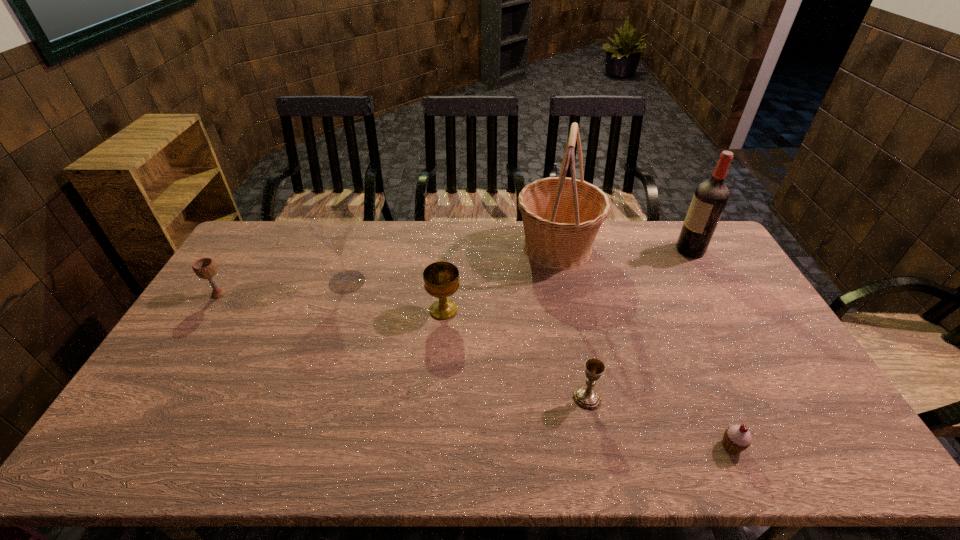
Where is `empty space between the sixth object from right to left and the second object from right to left`? This screenshot has width=960, height=540. empty space between the sixth object from right to left and the second object from right to left is located at coordinates (540, 364).

Identify which object is the second nearest to the rightmost object. Please provide its 2D coordinates. Your answer should be formatted as a tuple, i.e. [(x, y)], where the tuple contains the x and y coordinates of a point satisfying the conditions above.

[(586, 396)]

Find the location of a particular element. The image size is (960, 540). object identified as the closest to the leftmost chalice is located at coordinates (333, 229).

Where is `chalice that is the closest to the second tallest object`? This screenshot has height=540, width=960. chalice that is the closest to the second tallest object is located at coordinates (586, 396).

Locate an element on the screen. chalice that is the nearest to the rightmost chalice is located at coordinates (441, 279).

Where is `vacant area in the image that satisfies the following two spatial constraints: 1. on the front side of the second object from right to left; 2. on the left side of the leftmost object`? The width and height of the screenshot is (960, 540). vacant area in the image that satisfies the following two spatial constraints: 1. on the front side of the second object from right to left; 2. on the left side of the leftmost object is located at coordinates (124, 446).